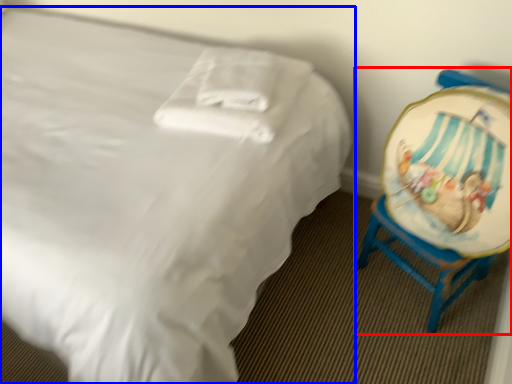
Question: Which of the following is the closest to the observer, chair (highlighted by a red box) or bed (highlighted by a blue box)?

Choices:
 (A) chair
 (B) bed

Answer: (B)